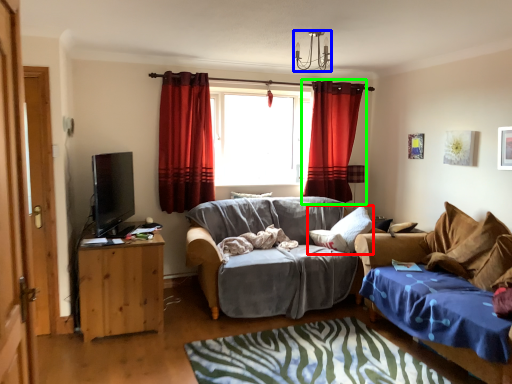
Question: Which is farther away from pillow (highlighted by a red box)? lamp (highlighted by a blue box) or curtain (highlighted by a green box)?

Choices:
 (A) lamp
 (B) curtain

Answer: (A)